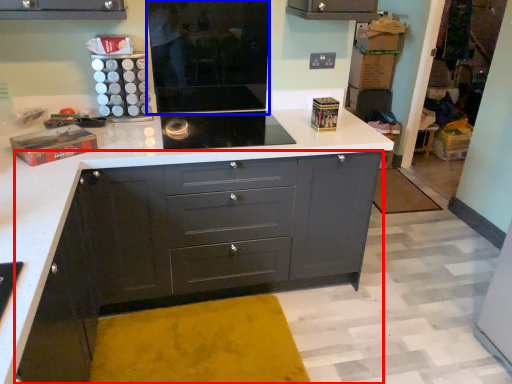
Question: Which of the following is the farthest to the observer, chest of drawers (highlighted by a red box) or appliance (highlighted by a blue box)?

Choices:
 (A) chest of drawers
 (B) appliance

Answer: (B)